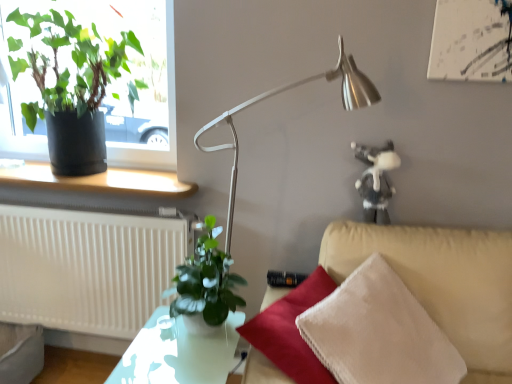
Question: Should I look upward or downward to see matte black window sill at lower left?

Choices:
 (A) up
 (B) down

Answer: (A)

Question: Is green matte plant at upper left, which ranks as the first houseplant in top-to-bottom order, with translucent glass table at center?

Choices:
 (A) no
 (B) yes

Answer: (A)

Question: Would you say green matte plant at upper left, which is the first houseplant from left to right, contains translucent glass table at center?

Choices:
 (A) no
 (B) yes

Answer: (A)

Question: Is green matte plant at upper left, which is the first houseplant from left to right, facing towards translucent glass table at center?

Choices:
 (A) no
 (B) yes

Answer: (A)

Question: Is green matte plant at upper left, which is the first houseplant from left to right, smaller than translucent glass table at center?

Choices:
 (A) yes
 (B) no

Answer: (B)

Question: Is green matte plant at upper left, which ranks as the second houseplant in bottom-to-top order, not inside translucent glass table at center?

Choices:
 (A) no
 (B) yes

Answer: (B)

Question: From the image's perspective, is green matte plant at upper left, which is the first houseplant from left to right, located beneath translucent glass table at center?

Choices:
 (A) no
 (B) yes

Answer: (A)

Question: Is white textured radiator at lower left touching satin silver lamp at center?

Choices:
 (A) no
 (B) yes

Answer: (A)

Question: Can you confirm if white textured radiator at lower left is shorter than satin silver lamp at center?

Choices:
 (A) yes
 (B) no

Answer: (A)

Question: Does white textured radiator at lower left have a lesser width compared to satin silver lamp at center?

Choices:
 (A) no
 (B) yes

Answer: (B)

Question: Considering the relative sizes of white textured radiator at lower left and satin silver lamp at center in the image provided, is white textured radiator at lower left smaller than satin silver lamp at center?

Choices:
 (A) yes
 (B) no

Answer: (A)

Question: From a real-world perspective, is white textured radiator at lower left physically above satin silver lamp at center?

Choices:
 (A) yes
 (B) no

Answer: (B)

Question: Is white textured radiator at lower left facing away from satin silver lamp at center?

Choices:
 (A) yes
 (B) no

Answer: (B)

Question: Is satin silver lamp at center far from white textured radiator at lower left?

Choices:
 (A) yes
 (B) no

Answer: (B)